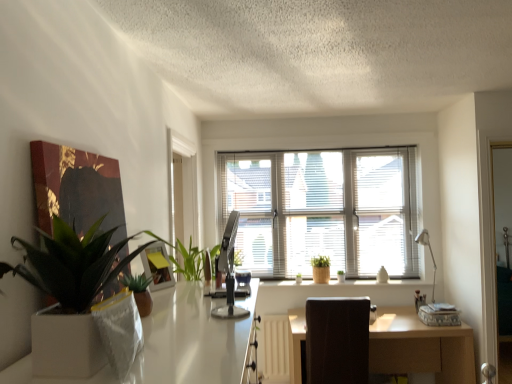
Find the location of a particular element. This screenshot has width=512, height=384. light brown wooden desk at center is located at coordinates (420, 347).

Describe the element at coordinates (420, 347) in the screenshot. I see `light brown wooden desk at center` at that location.

This screenshot has width=512, height=384. In order to click on silver metallic desk lamp at right in this screenshot , I will do `click(430, 254)`.

Consider the image. Is green matte plant at left, which is the 1th houseplant from top to bottom, oriented towards yellow paper picture frame at upper center?

No.

Is green matte plant at left, positioned as the 2th houseplant in right-to-left order, inside the boundaries of yellow paper picture frame at upper center, or outside?

green matte plant at left, positioned as the 2th houseplant in right-to-left order, cannot be found inside yellow paper picture frame at upper center.

Image resolution: width=512 pixels, height=384 pixels. What are the coordinates of `picture frame that is below the green matte plant at left, which is counted as the 1th houseplant, starting from the front (from the image's perspective)` in the screenshot? It's located at (157, 266).

Between point (120, 242) and point (167, 278), which one is positioned behind?

The point (167, 278) is behind.

Would you say light brown wooden desk at center contains white glossy desk at center?

Actually, white glossy desk at center is outside light brown wooden desk at center.

Locate an element on the screen. The width and height of the screenshot is (512, 384). table located underneath the white glossy desk at center (from a real-world perspective) is located at coordinates (420, 347).

Can you tell me how much light brown wooden desk at center and white glossy desk at center differ in facing direction?

There is a 88-degree angle between the facing directions of light brown wooden desk at center and white glossy desk at center.

Is light brown wooden desk at center facing towards white glossy desk at center?

Yes.

The image size is (512, 384). I want to click on swivel chair located on the left of light brown wooden desk at center, so click(x=337, y=340).

Is the depth of light brown wooden desk at center greater than that of brown fabric swivel chair at center?

Yes, it is.

From a real-world perspective, which object rests below the other?

From a 3D spatial view, light brown wooden desk at center is below.

Is light brown wooden desk at center to the right of brown fabric swivel chair at center from the viewer's perspective?

Indeed, light brown wooden desk at center is positioned on the right side of brown fabric swivel chair at center.

Is white glossy desk at center positioned before green matte plant at left, which is counted as the 1th houseplant, starting from the front?

Yes, white glossy desk at center is in front of green matte plant at left, which is counted as the 1th houseplant, starting from the front.

Is white glossy desk at center not inside green matte plant at left, which is the 1th houseplant from top to bottom?

white glossy desk at center is positioned outside green matte plant at left, which is the 1th houseplant from top to bottom.

Is white glossy desk at center at the left side of green matte plant at left, positioned as the 2th houseplant in right-to-left order?

No, white glossy desk at center is not to the left of green matte plant at left, positioned as the 2th houseplant in right-to-left order.

Can you confirm if white glossy desk at center is taller than green matte plant at left, which is the 1th houseplant from top to bottom?

Yes, white glossy desk at center is taller than green matte plant at left, which is the 1th houseplant from top to bottom.

Is silver metallic desk lamp at right looking in the opposite direction of white ceramic vase at center?

That's not correct — silver metallic desk lamp at right is not looking away from white ceramic vase at center.

From their relative heights in the image, would you say silver metallic desk lamp at right is taller or shorter than white ceramic vase at center?

Considering their sizes, silver metallic desk lamp at right has more height than white ceramic vase at center.

Does point (419, 243) come in front of point (261, 280)?

No, it is behind (261, 280).

Considering the positions of objects yellow paper picture frame at upper center and green matte plant at left, the first houseplant in the left-to-right sequence, in the image provided, who is behind, yellow paper picture frame at upper center or green matte plant at left, the first houseplant in the left-to-right sequence,?

yellow paper picture frame at upper center is further away from the camera.

Is green matte plant at left, which is the 1th houseplant from top to bottom, at the back of yellow paper picture frame at upper center?

No, green matte plant at left, which is the 1th houseplant from top to bottom, is not at the back of yellow paper picture frame at upper center.

Between yellow paper picture frame at upper center and green matte plant at left, positioned as the 2th houseplant in right-to-left order, which one has more height?

With more height is green matte plant at left, positioned as the 2th houseplant in right-to-left order.

Is yellow paper picture frame at upper center outside of green matte plant at left, positioned as the 2th houseplant in right-to-left order?

yellow paper picture frame at upper center lies outside green matte plant at left, positioned as the 2th houseplant in right-to-left order,'s area.

From the image's perspective, relative to light brown wooden desk at center, is green matte plant at left, which is the 1th houseplant from top to bottom, above or below?

green matte plant at left, which is the 1th houseplant from top to bottom, is above light brown wooden desk at center.

Is point (75, 275) positioned behind point (407, 359)?

No, it is in front of (407, 359).

Is green matte plant at left, positioned as the 2th houseplant in right-to-left order, in contact with light brown wooden desk at center?

No, green matte plant at left, positioned as the 2th houseplant in right-to-left order, is not with light brown wooden desk at center.

Is green matte plant at left, the first houseplant in the left-to-right sequence, wider or thinner than light brown wooden desk at center?

Considering their sizes, green matte plant at left, the first houseplant in the left-to-right sequence, looks slimmer than light brown wooden desk at center.

Image resolution: width=512 pixels, height=384 pixels. I want to click on houseplant above the yellow paper picture frame at upper center (from the image's perspective), so click(71, 292).

The height and width of the screenshot is (384, 512). I want to click on table that appears on the right of white glossy desk at center, so click(x=420, y=347).

Which object lies nearer to the anchor point light brown wooden desk at center, brown fabric swivel chair at center or silver metallic desk lamp at right?

brown fabric swivel chair at center lies closer to light brown wooden desk at center than the other object.

Which object lies nearer to the anchor point green matte plant at left, which is the 1th houseplant from top to bottom, green woven basket at center, which is the first houseplant in back-to-front order, or brown fabric swivel chair at center?

brown fabric swivel chair at center is positioned closer to the anchor green matte plant at left, which is the 1th houseplant from top to bottom.

Estimate the real-world distances between objects in this image. Which object is closer to yellow paper picture frame at upper center, white blinds at center or green woven basket at center, which is the first houseplant in back-to-front order?

green woven basket at center, which is the first houseplant in back-to-front order, is closer to yellow paper picture frame at upper center.

Based on their spatial positions, is silver metallic desk lamp at right or white glossy desk at center closer to white blinds at center?

The object closer to white blinds at center is silver metallic desk lamp at right.

Which object lies further to the anchor point white ceramic vase at center, green woven basket at center, marked as the 2th houseplant in a top-to-bottom arrangement, or silver metallic desk lamp at right?

silver metallic desk lamp at right lies further to white ceramic vase at center than the other object.

Considering their positions, is green woven basket at center, marked as the second houseplant in a front-to-back arrangement, positioned further to yellow paper picture frame at upper center than white ceramic vase at center?

green woven basket at center, marked as the second houseplant in a front-to-back arrangement, is further to yellow paper picture frame at upper center.

Based on their spatial positions, is green matte plant at left, which is counted as the 1th houseplant, starting from the front, or silver metallic desk lamp at right closer to white ceramic vase at center?

Based on the image, silver metallic desk lamp at right appears to be nearer to white ceramic vase at center.

In the scene shown: When comparing their distances from white ceramic vase at center, does silver metallic desk lamp at right or green matte plant at left, which is counted as the 1th houseplant, starting from the front, seem further?

green matte plant at left, which is counted as the 1th houseplant, starting from the front.

Where is `houseplant located between white glossy desk at center and light brown wooden desk at center in the depth direction`? houseplant located between white glossy desk at center and light brown wooden desk at center in the depth direction is located at coordinates (71, 292).

Where is `table lamp between yellow paper picture frame at upper center and green woven basket at center, marked as the first houseplant in a right-to-left arrangement, from front to back`? The height and width of the screenshot is (384, 512). table lamp between yellow paper picture frame at upper center and green woven basket at center, marked as the first houseplant in a right-to-left arrangement, from front to back is located at coordinates click(x=430, y=254).

Where is `table between brown fabric swivel chair at center and green woven basket at center, which ranks as the 1th houseplant in bottom-to-top order, in the front-back direction`? The image size is (512, 384). table between brown fabric swivel chair at center and green woven basket at center, which ranks as the 1th houseplant in bottom-to-top order, in the front-back direction is located at coordinates (420, 347).

This screenshot has width=512, height=384. What are the coordinates of `window sill between light brown wooden desk at center and green woven basket at center, which is the 2th houseplant from left to right, in the front-back direction` in the screenshot? It's located at (351, 284).